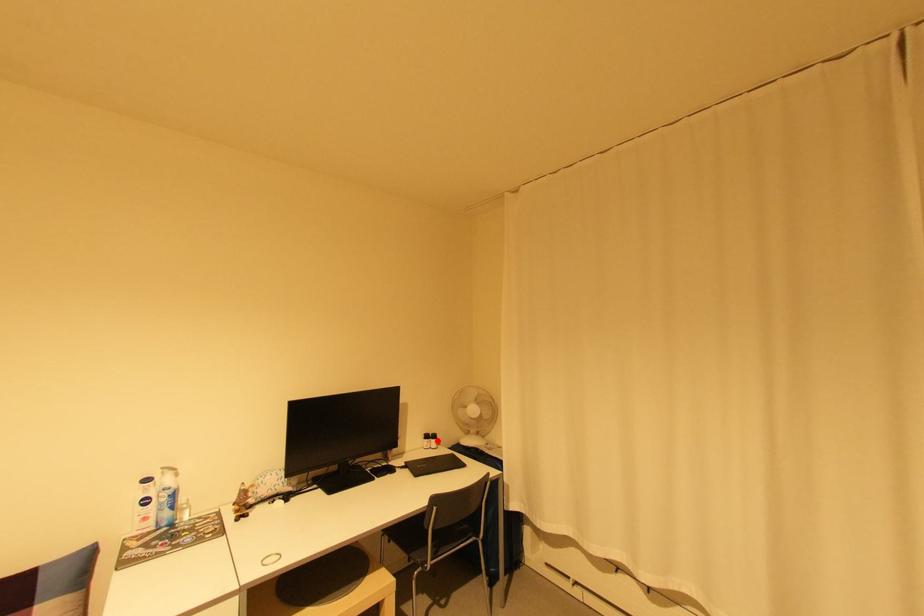
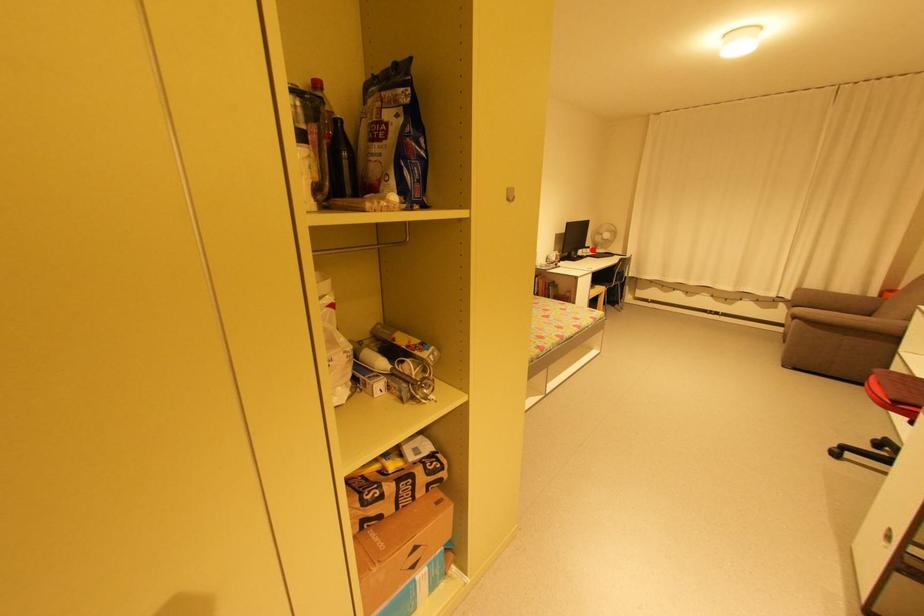
I am providing you with two images of the same scene from different viewpoints. A red point is marked on the first image and another point is marked on the second image. Is the red point in image1 aligned with the point shown in image2?

Yes